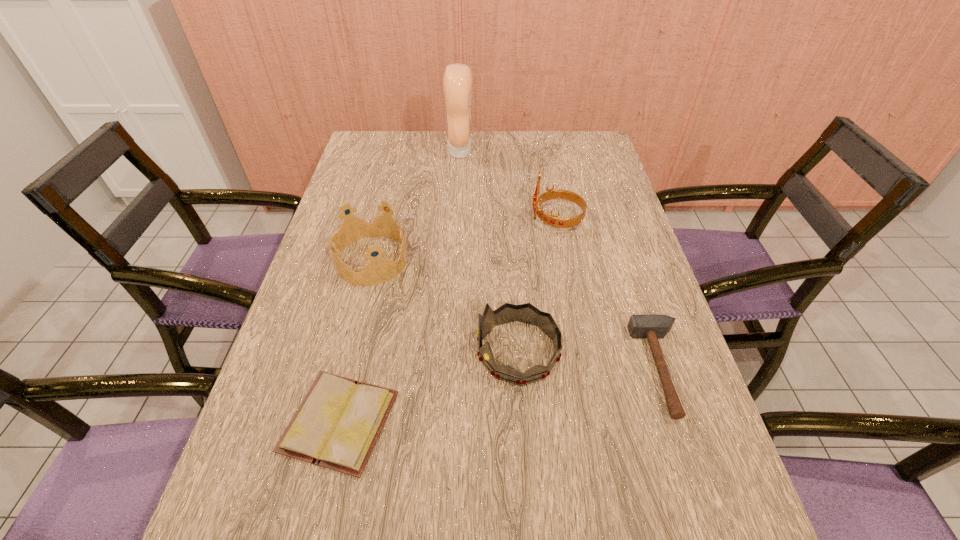
Locate an element on the screen. This screenshot has width=960, height=540. vacant region located on the striking surface of the rightmost object is located at coordinates (615, 369).

At what (x,y) coordinates should I click in order to perform the action: click on free region located on the front of the shortest object. Please return your answer as a coordinate pair (x, y). The height and width of the screenshot is (540, 960). Looking at the image, I should click on (317, 516).

Locate an element on the screen. object present at the far edge is located at coordinates (457, 80).

You are a GUI agent. You are given a task and a screenshot of the screen. Output one action in this format:
    pyautogui.click(x=<x>, y=<y>)
    Task: Click on the tiara at the left edge
    
    Given the screenshot: What is the action you would take?
    pyautogui.click(x=379, y=270)

Locate an element on the screen. diary situated at the left edge is located at coordinates (337, 425).

The height and width of the screenshot is (540, 960). In order to click on tiara that is at the right edge in this screenshot , I will do `click(553, 220)`.

Where is `hammer at the right edge`? hammer at the right edge is located at coordinates (651, 327).

Image resolution: width=960 pixels, height=540 pixels. What are the coordinates of `free space at the far edge` in the screenshot? It's located at click(x=406, y=149).

You are a GUI agent. You are given a task and a screenshot of the screen. Output one action in this format:
    pyautogui.click(x=<x>, y=<y>)
    Task: Click on the vacant area at the left edge of the desktop
    
    Given the screenshot: What is the action you would take?
    [355, 304]

This screenshot has height=540, width=960. Identify the location of vacant position at the right edge of the desktop. (581, 190).